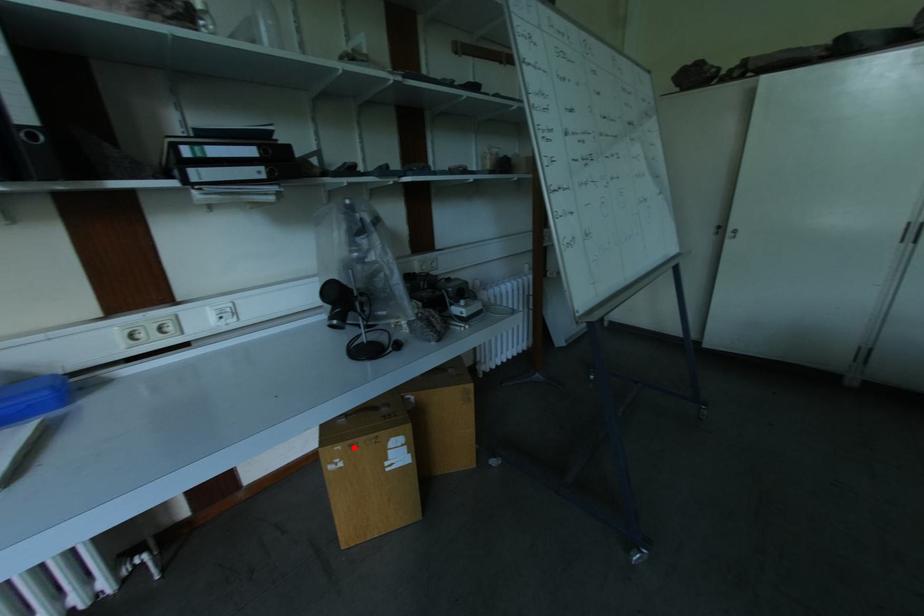
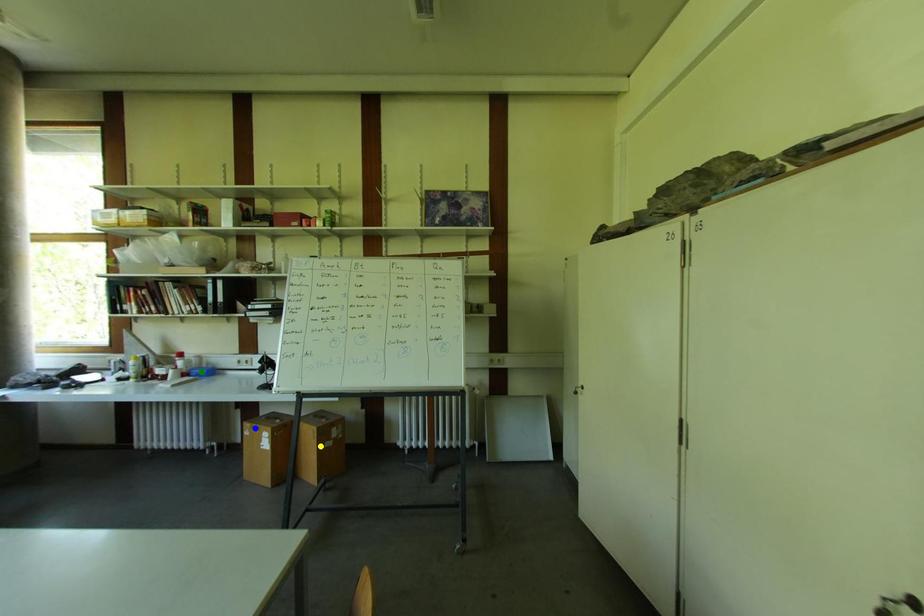
Question: I am providing you with two images of the same scene from different viewpoints. A red point is marked on the first image. You are given multiple points on the second image. Which point in image 2 represents the same 3d spot as the red point in image 1?

Choices:
 (A) yellow point
 (B) blue point
 (C) green point

Answer: (B)